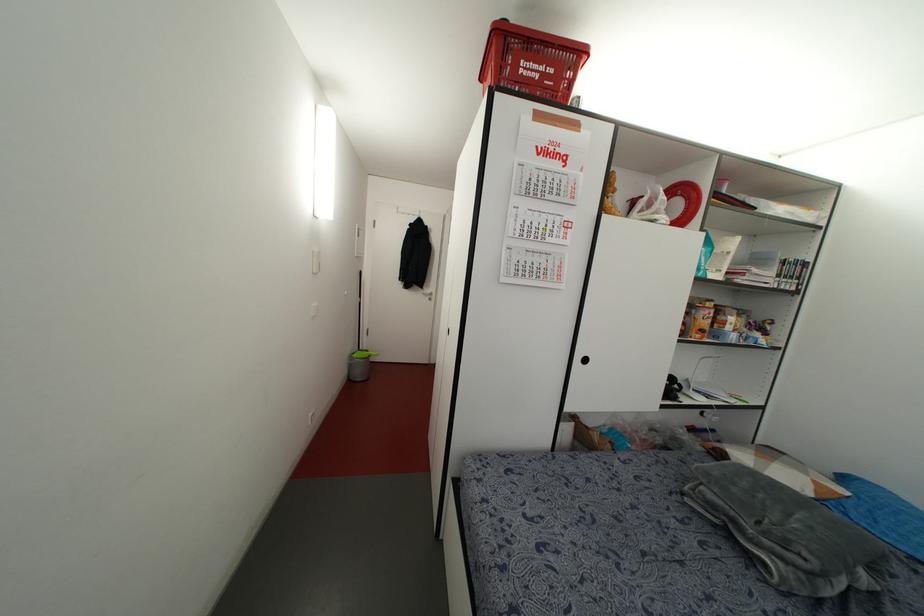
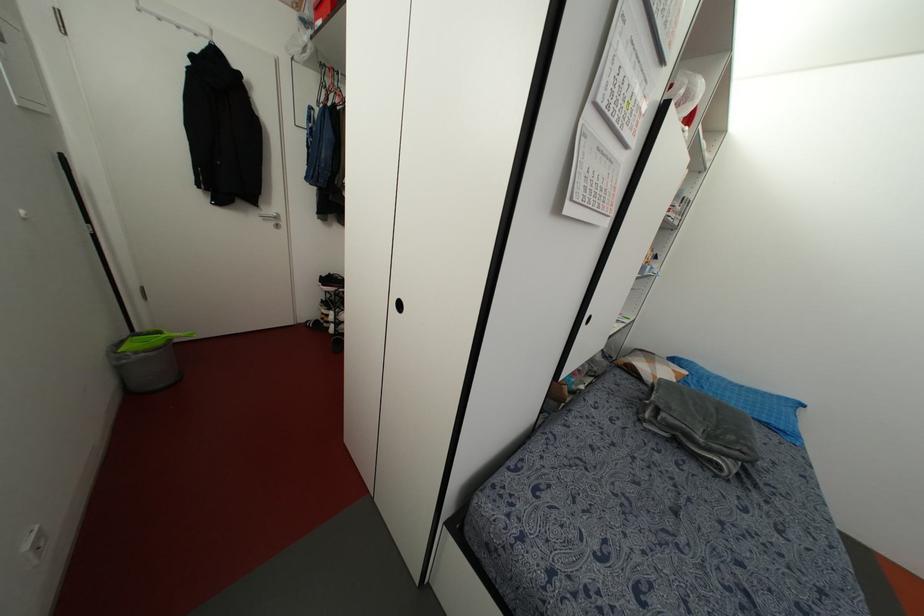
Locate, in the second image, the point that corresponds to [701,488] in the first image.

(663, 415)